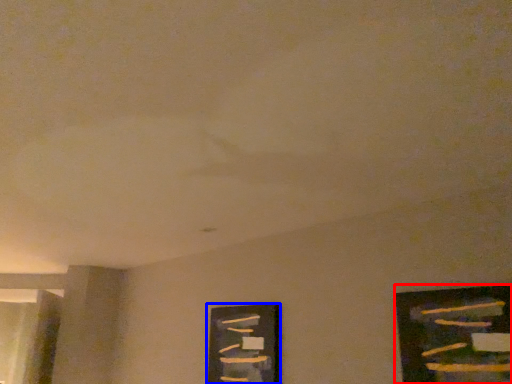
Question: Among these objects, which one is farthest to the camera, picture frame (highlighted by a red box) or picture frame (highlighted by a blue box)?

Choices:
 (A) picture frame
 (B) picture frame

Answer: (B)